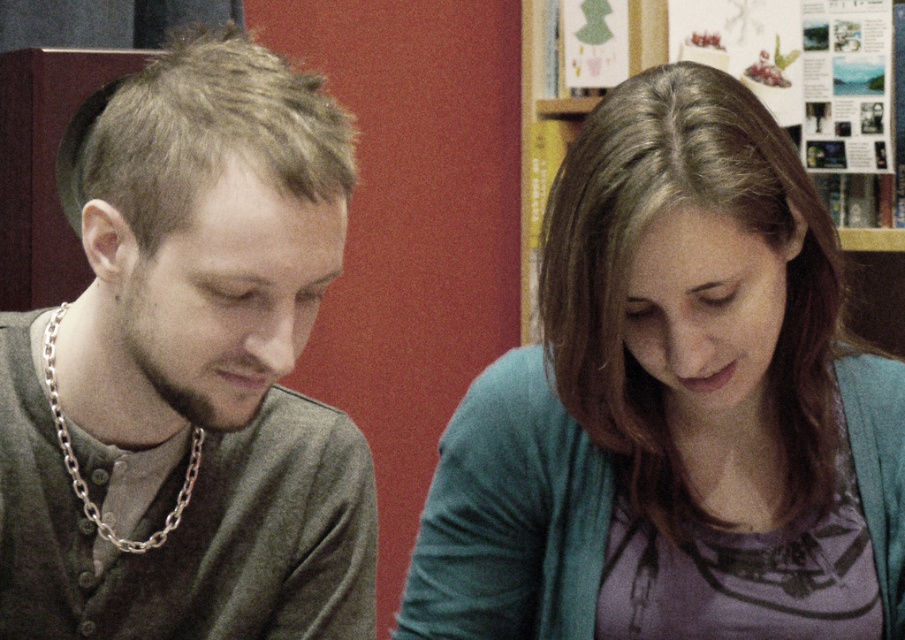
Question: Which point is farther to the camera?

Choices:
 (A) (894, 440)
 (B) (78, 236)

Answer: (B)

Question: Does purple cotton shirt at center appear on the left side of wooden bookshelf at upper center?

Choices:
 (A) no
 (B) yes

Answer: (A)

Question: Which point is farther from the camera taking this photo?

Choices:
 (A) (218, 416)
 (B) (511, 401)

Answer: (B)

Question: Does matte gray sweater at left appear over wooden bookshelf at upper center?

Choices:
 (A) no
 (B) yes

Answer: (A)

Question: In this image, where is purple cotton shirt at center located relative to matte gray sweater at left?

Choices:
 (A) below
 (B) above

Answer: (A)

Question: Based on their relative distances, which object is farther from the matte gray sweater at left?

Choices:
 (A) wooden bookshelf at upper center
 (B) purple cotton shirt at center

Answer: (A)